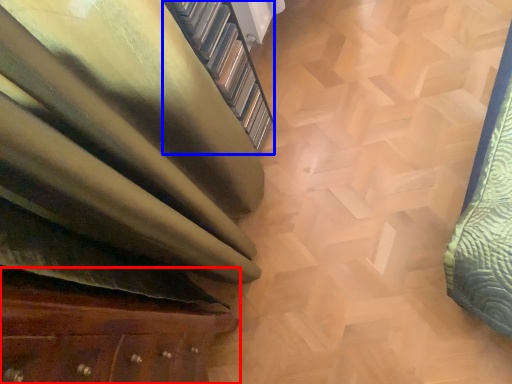
Question: Which object is further to the camera taking this photo, furniture (highlighted by a red box) or stairwell (highlighted by a blue box)?

Choices:
 (A) furniture
 (B) stairwell

Answer: (B)